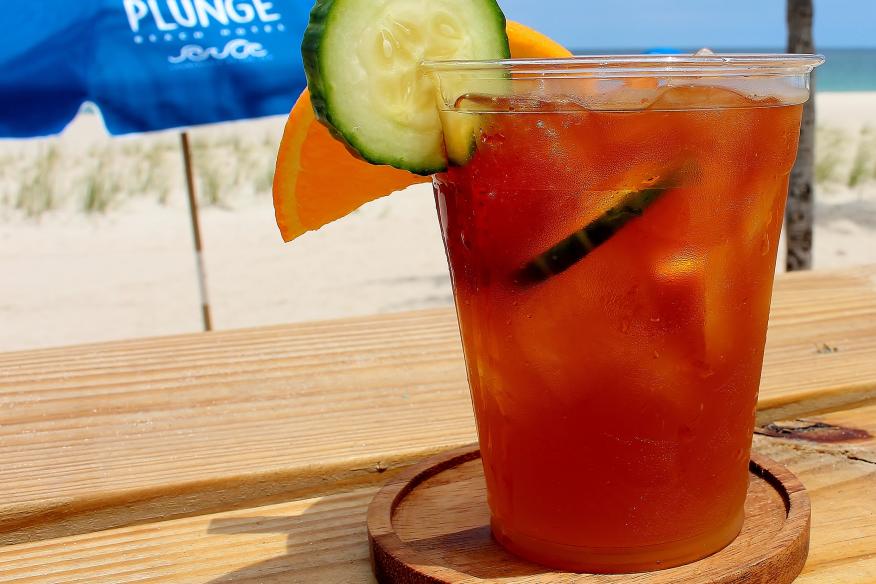
Locate an element on the screen. Image resolution: width=876 pixels, height=584 pixels. white wall is located at coordinates (280, 259).